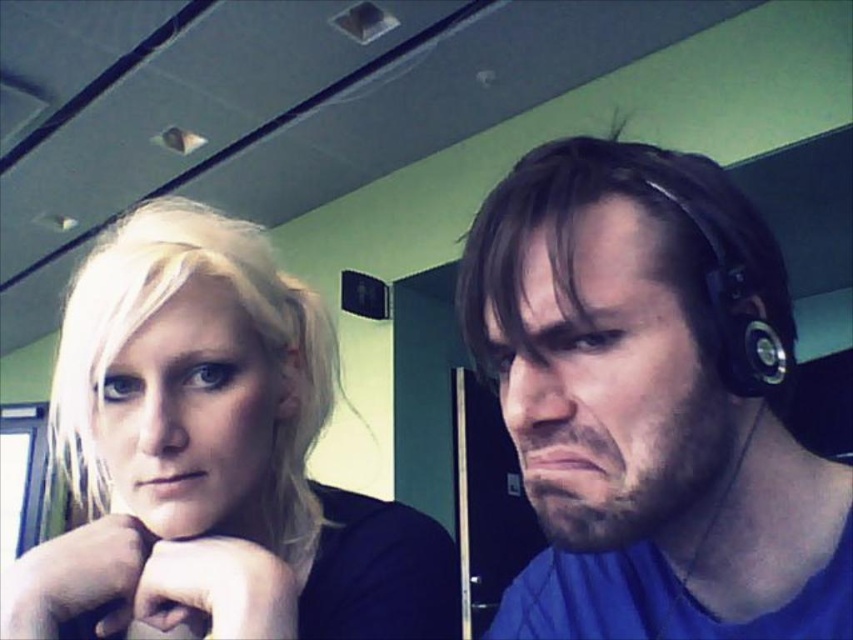
Question: Among these objects, which one is nearest to the camera?

Choices:
 (A) black rubber earphone at right
 (B) matte black headphones at right

Answer: (B)

Question: Is blonde hair at left below black rubber earphone at right?

Choices:
 (A) no
 (B) yes

Answer: (B)

Question: Which object is closer to the camera taking this photo?

Choices:
 (A) black rubber earphone at right
 (B) blonde hair at left

Answer: (A)

Question: Which object is closer to the camera taking this photo?

Choices:
 (A) matte black headphones at right
 (B) black rubber earphone at right

Answer: (A)

Question: Is matte black headphones at right smaller than black rubber earphone at right?

Choices:
 (A) yes
 (B) no

Answer: (B)

Question: Does blonde hair at left have a larger size compared to black rubber earphone at right?

Choices:
 (A) no
 (B) yes

Answer: (B)